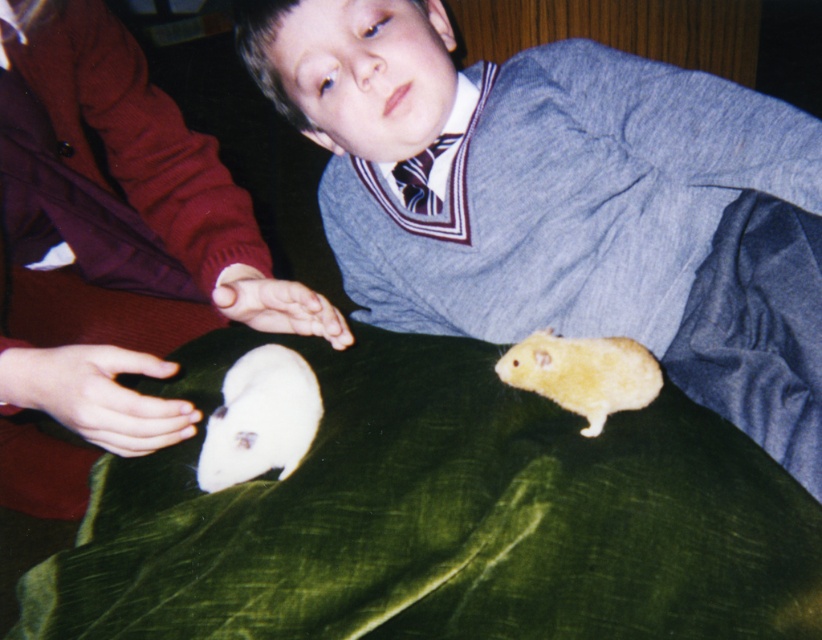
You are a photographer standing 30 inches away from the scene. You want to take a closeup shot of the matte gray sweater at center. Is the current distance sufficient to capture the sweater in focus without moving closer?

The matte gray sweater at center is 24.78 inches away from the viewer. Since you are standing 30 inches away, you are 5.22 inches further back than the sweater. To capture it in focus, you would need to adjust your position to be closer to the sweater or use a lens with a longer focal length to achieve the desired focus without moving closer.

You are standing at the origin point in the image. Which of the two points, point (732,314) or point (590,401), is closer to you?

Point (590,401) is closer to you because point (732,314) is behind it.